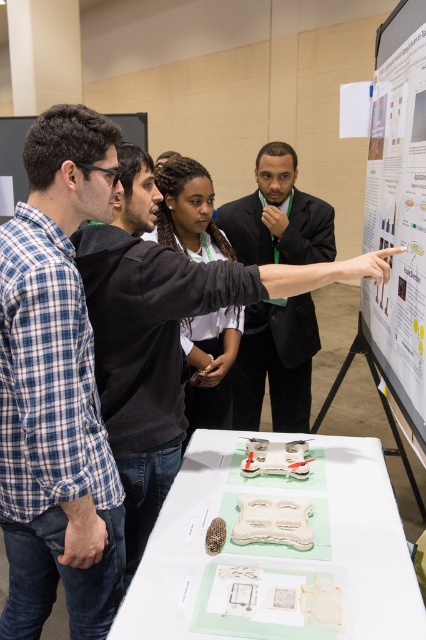
Image resolution: width=426 pixels, height=640 pixels. What do you see at coordinates (399, 208) in the screenshot?
I see `white matte poster at upper right` at bounding box center [399, 208].

Between white matte poster at upper right and black matte shirt at center, which one is positioned higher?

white matte poster at upper right is above.

In order to click on white matte poster at upper right in this screenshot , I will do `click(399, 208)`.

Where is `white matte poster at upper right`? This screenshot has width=426, height=640. white matte poster at upper right is located at coordinates (399, 208).

Who is more forward, (69, 556) or (394, 276)?

Point (69, 556) is more forward.

Is blue plaid shirt at left above white matte poster at upper right?

Actually, blue plaid shirt at left is below white matte poster at upper right.

At what (x,y) coordinates should I click in order to perform the action: click on blue plaid shirt at left. Please return your answer as a coordinate pair (x, y). Looking at the image, I should click on (57, 388).

Where is `blue plaid shirt at left`? blue plaid shirt at left is located at coordinates (57, 388).

Which is behind, point (51, 486) or point (164, 196)?

The point (164, 196) is behind.

Can you confirm if blue plaid shirt at left is shorter than black matte shirt at center?

In fact, blue plaid shirt at left may be taller than black matte shirt at center.

In order to click on blue plaid shirt at left in this screenshot , I will do `click(57, 388)`.

Where is `blue plaid shirt at left`? blue plaid shirt at left is located at coordinates (57, 388).